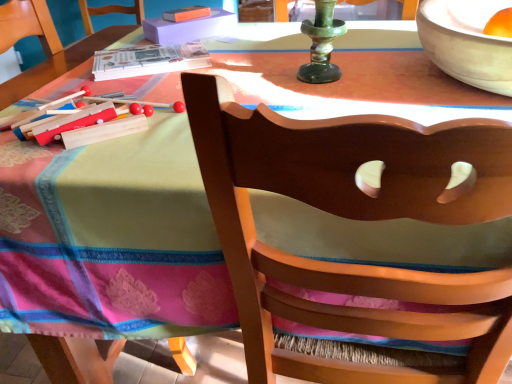
Where is `orange matte chair at upper left`? orange matte chair at upper left is located at coordinates (28, 25).

The height and width of the screenshot is (384, 512). What do you see at coordinates (28, 25) in the screenshot? I see `orange matte chair at upper left` at bounding box center [28, 25].

The image size is (512, 384). Describe the element at coordinates (354, 219) in the screenshot. I see `wooden chair at center` at that location.

The height and width of the screenshot is (384, 512). I want to click on wooden chair at center, so click(x=354, y=219).

This screenshot has width=512, height=384. What are the coordinates of `orange matte chair at upper left` in the screenshot? It's located at (28, 25).

Which object is positioned more to the right, wooden chair at center or orange matte chair at upper left?

Positioned to the right is wooden chair at center.

Consider the image. Between wooden chair at center and orange matte chair at upper left, which one is positioned in front?

Positioned in front is wooden chair at center.

Which is in front, point (362, 144) or point (44, 29)?

The point (362, 144) is in front.

From the image's perspective, which one is positioned lower, wooden chair at center or orange matte chair at upper left?

wooden chair at center appears lower in the image.

From a real-world perspective, who is located lower, wooden chair at center or orange matte chair at upper left?

In real-world perspective, wooden chair at center is lower.

Which of these two, wooden chair at center or orange matte chair at upper left, is thinner?

orange matte chair at upper left.

Is wooden chair at center shorter than orange matte chair at upper left?

No, wooden chair at center is not shorter than orange matte chair at upper left.

Who is smaller, wooden chair at center or orange matte chair at upper left?

orange matte chair at upper left is smaller.

Would you say wooden chair at center contains orange matte chair at upper left?

No, orange matte chair at upper left is located outside of wooden chair at center.

Are wooden chair at center and orange matte chair at upper left making contact?

They are not placed beside each other.

Is wooden chair at center oriented away from orange matte chair at upper left?

That's not correct — wooden chair at center is not looking away from orange matte chair at upper left.

Identify the location of armchair on the left of wooden chair at center. (28, 25).

In the image, is orange matte chair at upper left on the left side or the right side of wooden chair at center?

orange matte chair at upper left is positioned on wooden chair at center's left side.

Which object is further away from the camera taking this photo, orange matte chair at upper left or wooden chair at center?

Positioned behind is orange matte chair at upper left.

Considering the points (59, 51) and (434, 370), which point is in front, point (59, 51) or point (434, 370)?

The point (434, 370) is closer to the camera.

From the image's perspective, which one is positioned lower, orange matte chair at upper left or wooden chair at center?

wooden chair at center.

Looking at this image, from a real-world perspective, does orange matte chair at upper left stand above wooden chair at center?

Yes, from a real-world perspective, orange matte chair at upper left is on top of wooden chair at center.

Can you confirm if orange matte chair at upper left is thinner than wooden chair at center?

Yes.

From their relative heights in the image, would you say orange matte chair at upper left is taller or shorter than wooden chair at center?

Clearly, orange matte chair at upper left is shorter compared to wooden chair at center.

Which of these two, orange matte chair at upper left or wooden chair at center, is smaller?

orange matte chair at upper left is smaller.

Is orange matte chair at upper left completely or partially outside of wooden chair at center?

Yes, orange matte chair at upper left is outside of wooden chair at center.

Is orange matte chair at upper left far from wooden chair at center?

No, orange matte chair at upper left is not far from wooden chair at center.

From the picture: Is orange matte chair at upper left oriented towards wooden chair at center?

No, orange matte chair at upper left is not oriented towards wooden chair at center.

Based on the photo, what's the angular difference between orange matte chair at upper left and wooden chair at center's facing directions?

There is a 1.4-degree angle between the facing directions of orange matte chair at upper left and wooden chair at center.

Measure the distance from orange matte chair at upper left to wooden chair at center.

orange matte chair at upper left is 37.34 inches from wooden chair at center.

Identify the location of armchair that is above the wooden chair at center (from the image's perspective). This screenshot has height=384, width=512. (28, 25).

Find the location of a particular element. chair in front of the orange matte chair at upper left is located at coordinates (354, 219).

The height and width of the screenshot is (384, 512). In order to click on chair that is below the orange matte chair at upper left (from the image's perspective) in this screenshot , I will do `click(354, 219)`.